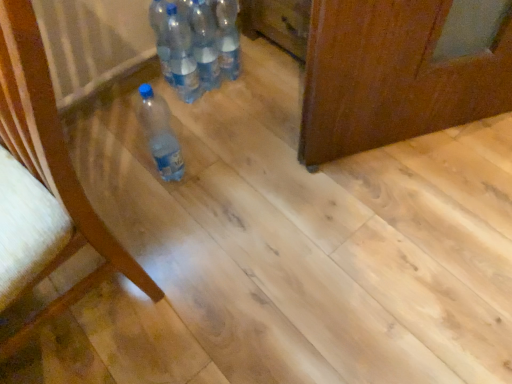
Image resolution: width=512 pixels, height=384 pixels. What are the coordinates of `vacant area that lies between matte wood chair at left and translucent plastic bottle at lower left, which is counted as the 4th bottle, starting from the top` in the screenshot? It's located at (157, 216).